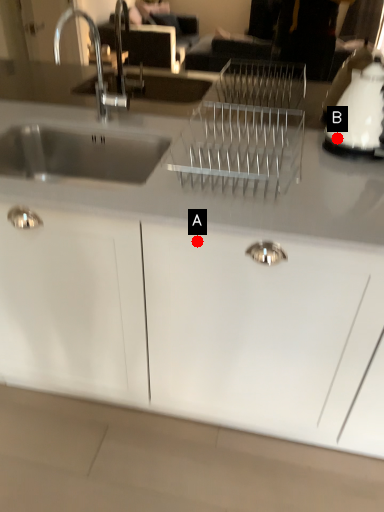
Question: Two points are circled on the image, labeled by A and B beside each circle. Which point is farther from the camera taking this photo?

Choices:
 (A) A is further
 (B) B is further

Answer: (B)